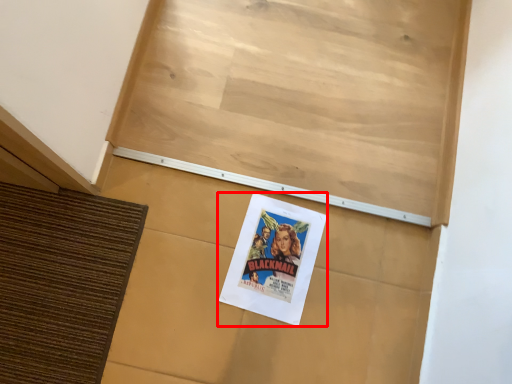
Question: From the image's perspective, considering the relative positions of poster (annotated by the red box) and bulletin board in the image provided, where is poster (annotated by the red box) located with respect to the staircase?

Choices:
 (A) below
 (B) above

Answer: (A)